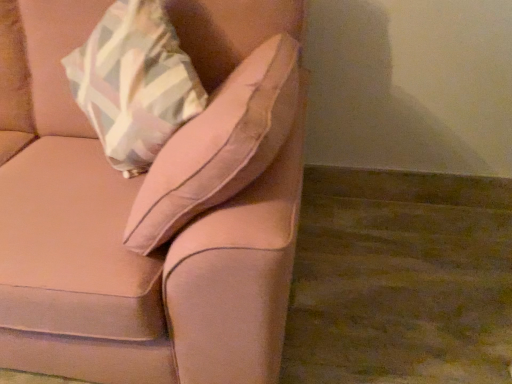
In order to click on suede-like beige couch at upper left in this screenshot , I will do `click(157, 212)`.

What do you see at coordinates (157, 212) in the screenshot? I see `suede-like beige couch at upper left` at bounding box center [157, 212].

Find the location of a particular element. This screenshot has height=384, width=512. suede-like beige couch at upper left is located at coordinates (157, 212).